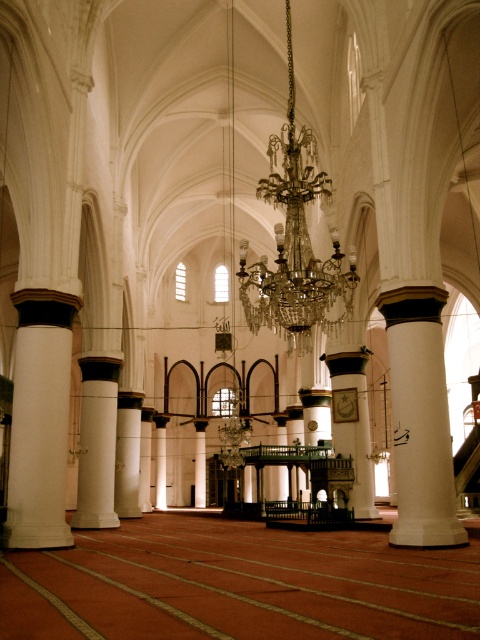
You are standing at the entrance of the grand mosque and want to reach a specific point marked at coordinates point (408, 497). If your walking speed is 3 feet per second, how many seconds will it take you to reach that point?

The distance between you and point (408, 497) is 159.55 feet. At a speed of 3 feet per second, it would take approximately 53.18 seconds to reach the point.

You are standing at the entrance of the grand mosque and see the white smooth column at center and the white marble pillar at center. Which one is closer to you?

The white smooth column at center is closer to you because it is positioned in front of the white marble pillar at center.

Looking at this image, you are standing in the grand mosque and want to walk from the entrance to the mihrab, which is behind the columns. Which column should you walk around first, the white smooth column at center or the white marble column at center?

You should walk around the white smooth column at center first because it is closer to you than the white marble column at center.